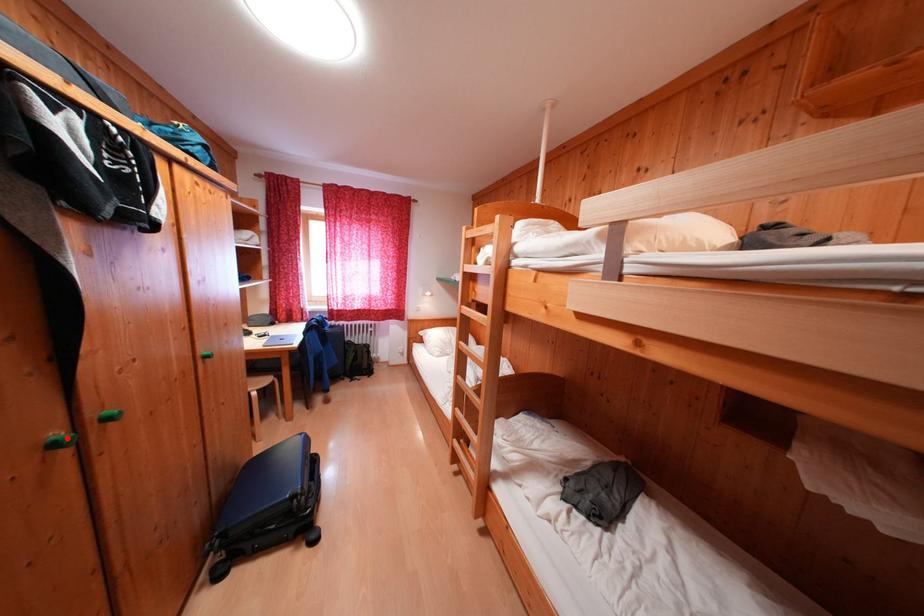
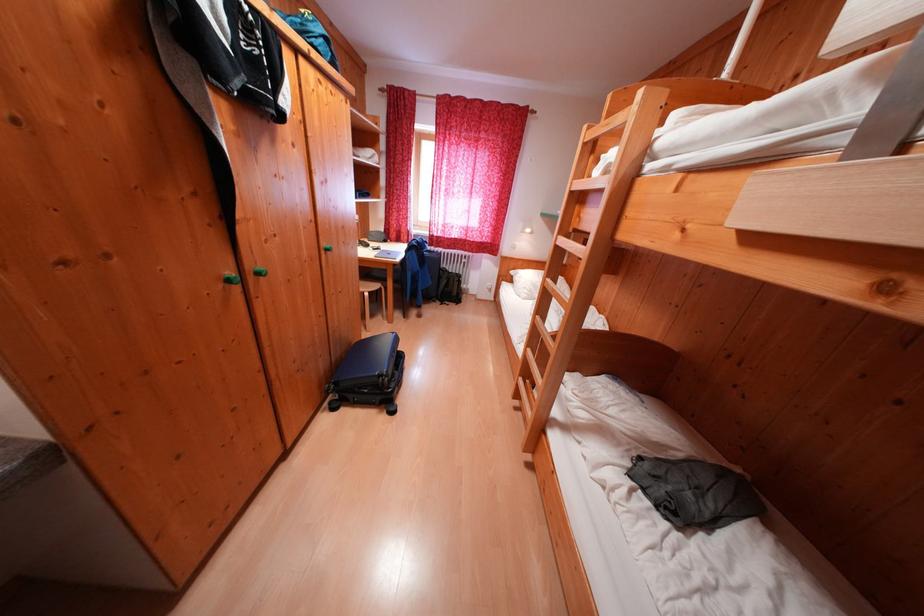
Question: A red point is marked in image1. In image2, is the corresponding 3D point closer to the camera or farther? Reply with the corresponding letter.

Choices:
 (A) The corresponding 3D point is closer.
 (B) The corresponding 3D point is farther.

Answer: (A)